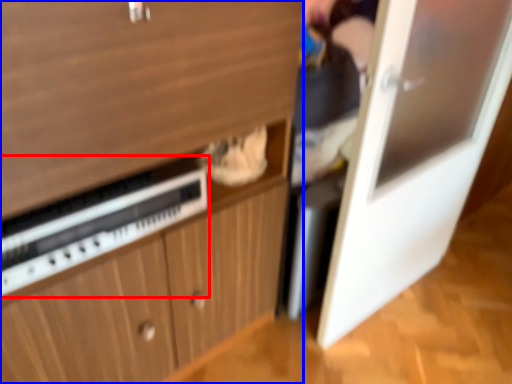
Question: Which object appears closest to the camera in this image, appliance (highlighted by a red box) or cabinetry (highlighted by a blue box)?

Choices:
 (A) appliance
 (B) cabinetry

Answer: (B)